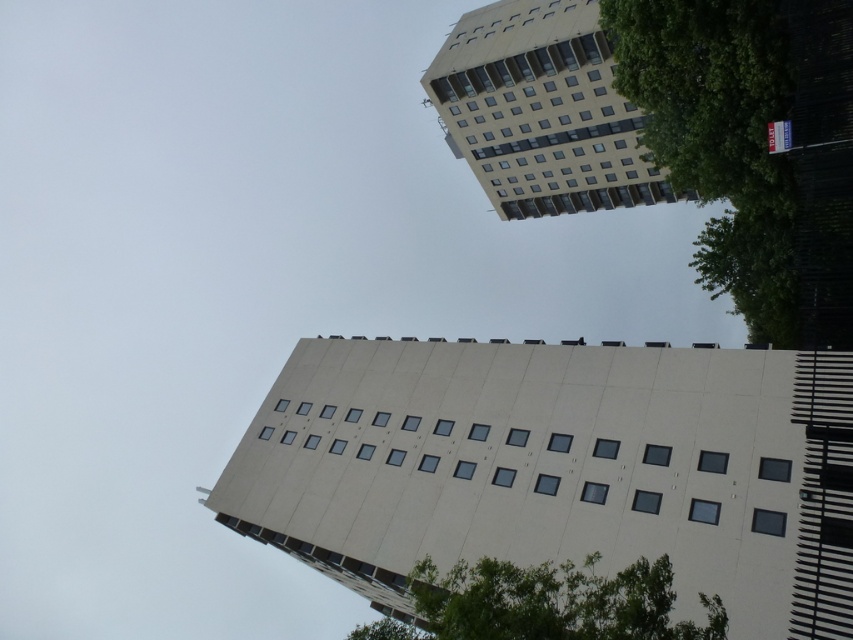
You are standing at the camera position and want to reach the point at coordinates point (746, 74). If you can walk 10 feet per minute, how many minutes will it take you to reach there?

The distance between point (746, 74) and the camera is 73.02 feet. At a walking speed of 10 feet per minute, it would take approximately 7.3 minutes to reach the point.

You are standing on the sidewalk looking up at the two buildings. Which object, the green leafy tree at upper right or the beige concrete building at upper center, is closer to you?

The green leafy tree at upper right is closer to you because it is in front of the beige concrete building at upper center.